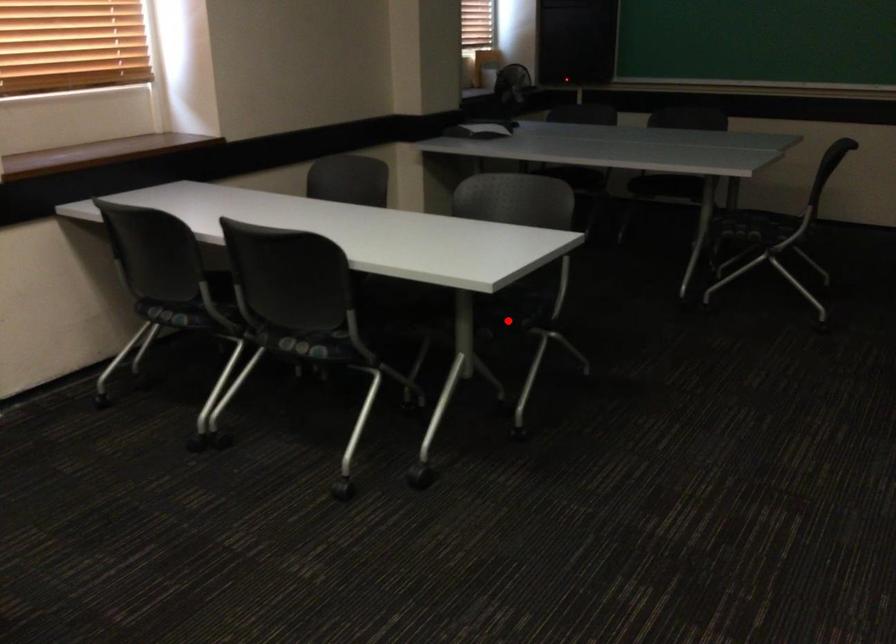
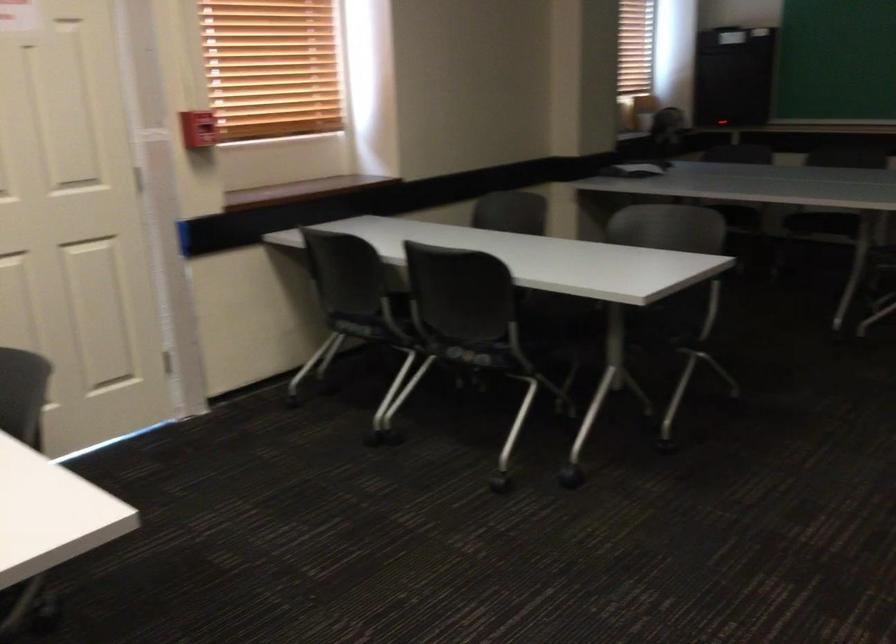
Locate, in the second image, the point that corresponds to the highlighted location in the first image.

(657, 337)